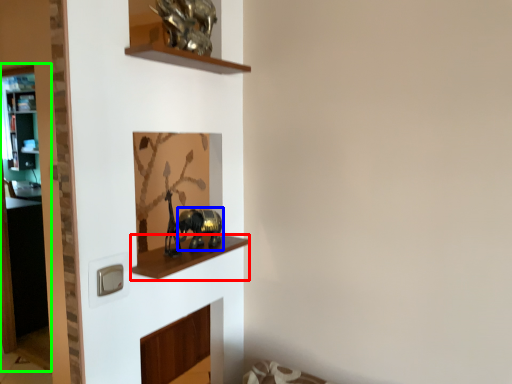
Question: Considering the real-world distances, which object is farthest from cabinet (highlighted by a red box)? animal (highlighted by a blue box) or glass door (highlighted by a green box)?

Choices:
 (A) animal
 (B) glass door

Answer: (B)